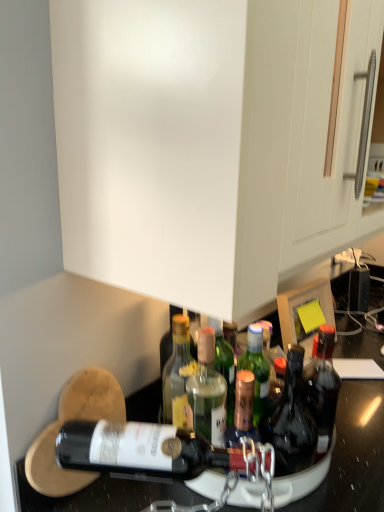
At what (x,y) coordinates should I click in order to perform the action: click on translucent glass bottle at center. Please return your answer as a coordinate pair (x, y). Image resolution: width=384 pixels, height=512 pixels. Looking at the image, I should click on (291, 421).

What do you see at coordinates (291, 421) in the screenshot? I see `translucent glass bottle at center` at bounding box center [291, 421].

Identify the location of translucent glass bottle at center. (291, 421).